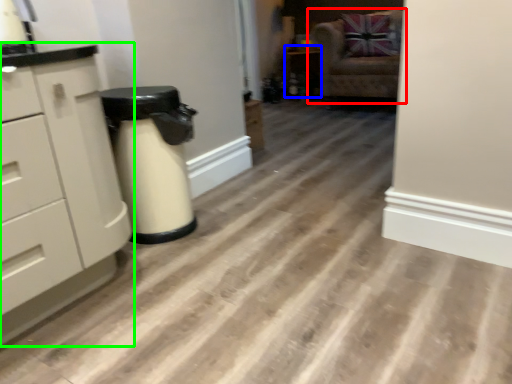
Question: Which is farther away from chair (highlighted by a red box)? cabinetry (highlighted by a blue box) or chest of drawers (highlighted by a green box)?

Choices:
 (A) cabinetry
 (B) chest of drawers

Answer: (B)